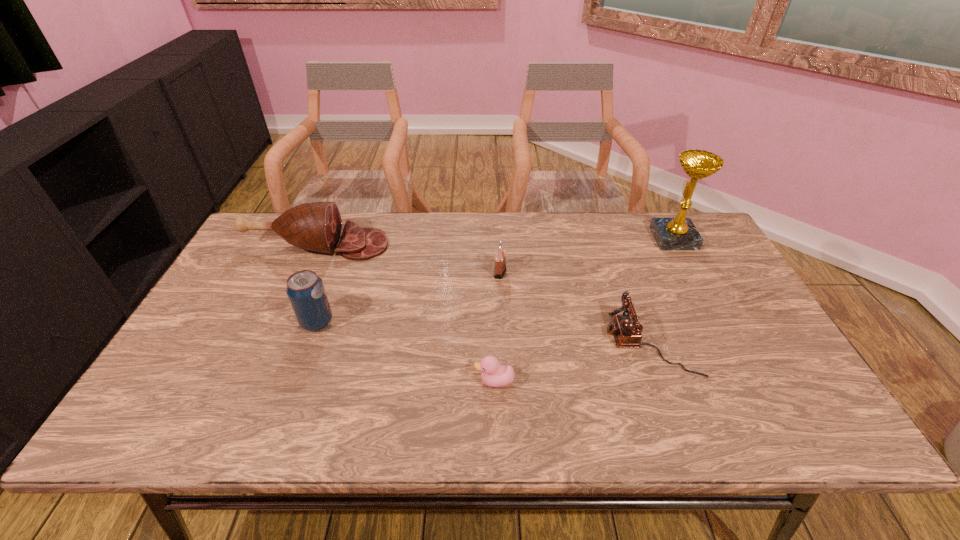
Image resolution: width=960 pixels, height=540 pixels. Find the location of `vacant space located at the sliced end of the ham`. vacant space located at the sliced end of the ham is located at coordinates (407, 245).

You are a GUI agent. You are given a task and a screenshot of the screen. Output one action in this format:
    pyautogui.click(x=<x>, y=<y>)
    Task: Click on the vacant region located on the left of the pop soda
    This screenshot has height=540, width=960.
    Given the screenshot: What is the action you would take?
    pyautogui.click(x=202, y=322)

You are a GUI agent. You are given a task and a screenshot of the screen. Output one action in this format:
    pyautogui.click(x=<x>, y=<y>)
    Task: Click on the free location located on the front of the third farthest object
    The image size is (960, 540).
    Given the screenshot: What is the action you would take?
    pyautogui.click(x=505, y=363)

This screenshot has width=960, height=540. Identify the location of free space located on the dial of the second object from right to left. (456, 343).

Locate an element on the screen. The image size is (960, 540). vacant space situated 0.380m on the dial of the second object from right to left is located at coordinates pyautogui.click(x=456, y=343).

Image resolution: width=960 pixels, height=540 pixels. In order to click on blank area located 0.270m on the dial of the second object from right to left in this screenshot , I will do 500,343.

I want to click on free space located 0.150m on the front-facing side of the duckling, so click(410, 381).

Where is `free space located 0.330m on the front-facing side of the duckling`? free space located 0.330m on the front-facing side of the duckling is located at coordinates (332, 381).

At what (x,y) coordinates should I click in order to perform the action: click on free space located 0.160m on the front-facing side of the duckling. Please return your answer as a coordinate pair (x, y). This screenshot has height=540, width=960. Looking at the image, I should click on (406, 381).

This screenshot has width=960, height=540. Identify the location of award at the far edge. (679, 233).